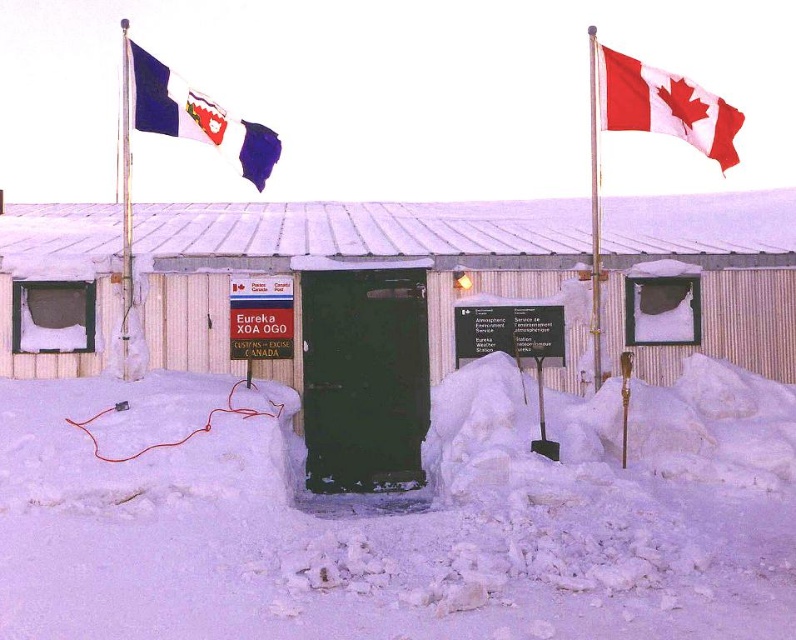
You are a researcher at the snow covered building and need to determine the relative sizes of the flags. Which object is smaller between the white fabric flag at upper right and the metallic silver flag pole at left?

The white fabric flag at upper right is smaller than the metallic silver flag pole at left.

You are a researcher at the outpost and need to secure both the white fabric flag at upper right and the metallic silver flag pole at left against strong winds. Which object is closer to the ground and might require a lower anchoring point?

The white fabric flag at upper right is positioned under the metallic silver flag pole at left, meaning it is closer to the ground and would need a lower anchoring point.

You are standing at point (x=359, y=304) in the snow. What object is directly beneath your feet?

The green corrugated metal hut at center is directly beneath your feet at point (x=359, y=304).